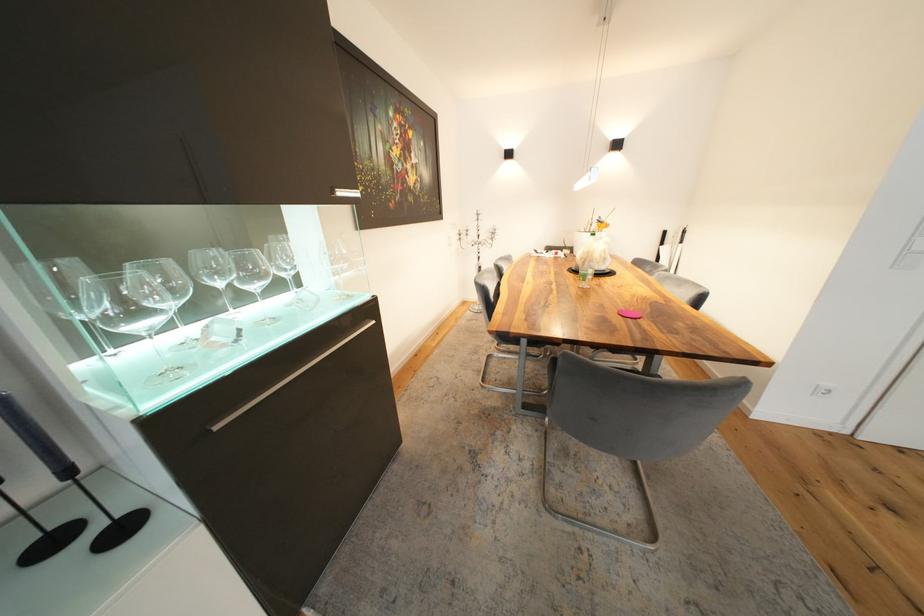
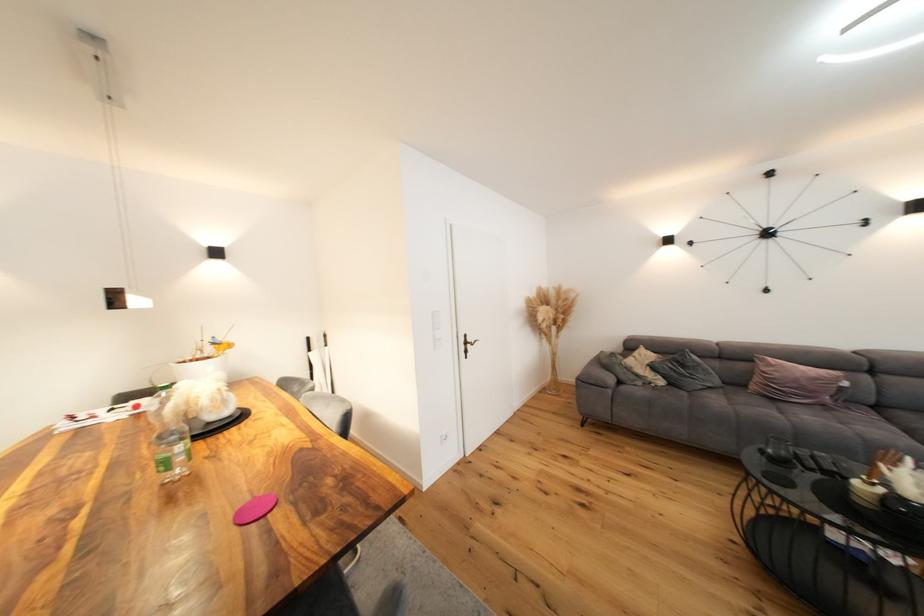
Find the pixel in the second image that matches point 591,282 in the first image.

(176, 469)